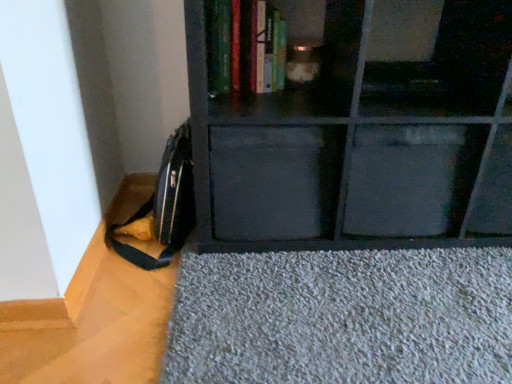
At what (x,y) coordinates should I click in order to perform the action: click on free space in front of matte black shelf at center. Please return your answer as a coordinate pair (x, y). This screenshot has height=384, width=512. Looking at the image, I should click on (375, 301).